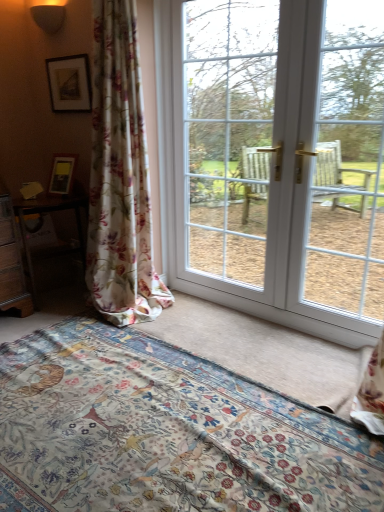
Locate an element on the screen. The width and height of the screenshot is (384, 512). vacant space situated on the left part of floral fabric curtain at left is located at coordinates (41, 324).